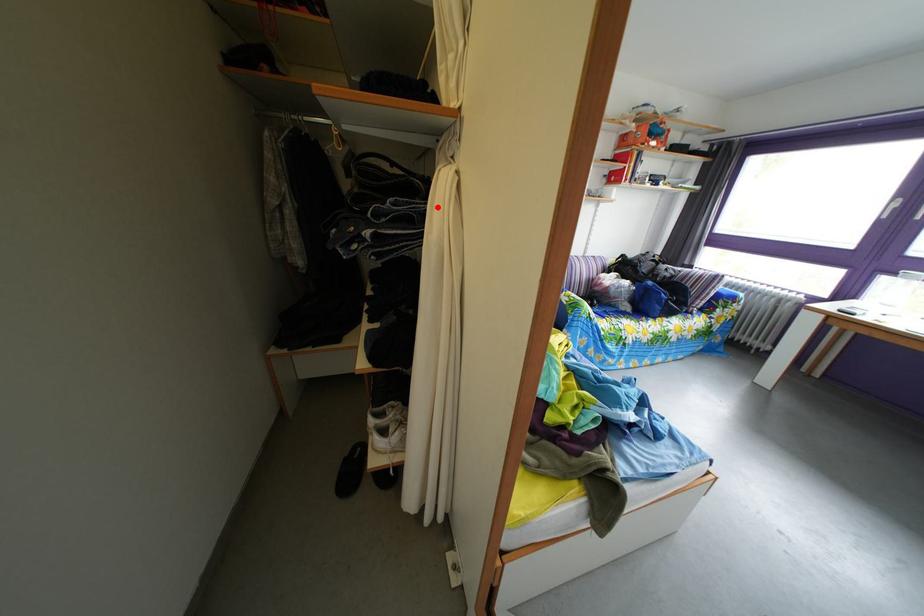
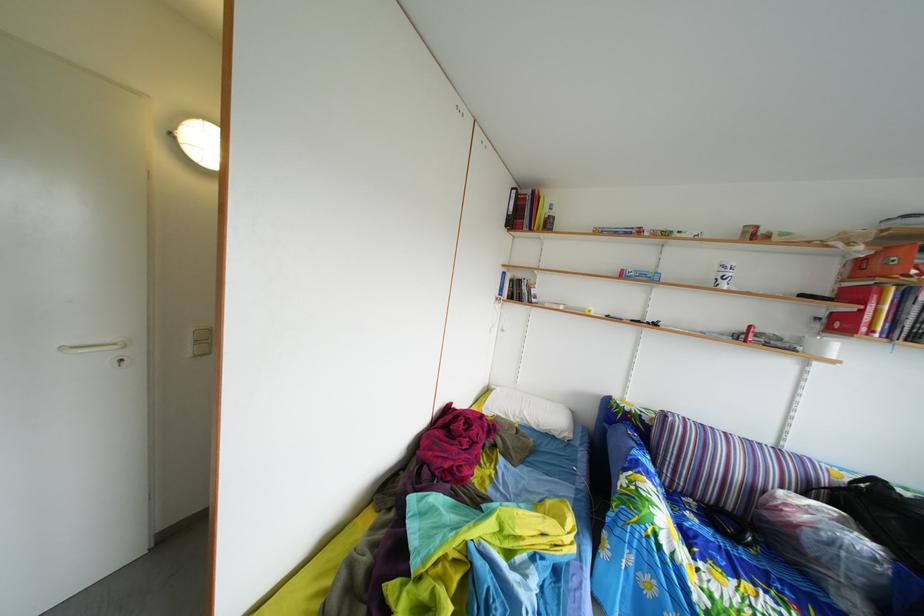
Question: I am providing you with two images of the same scene from different viewpoints. A red point is marked on the first image. Is the red point's position out of view in image 2?

Choices:
 (A) Yes
 (B) No

Answer: (A)